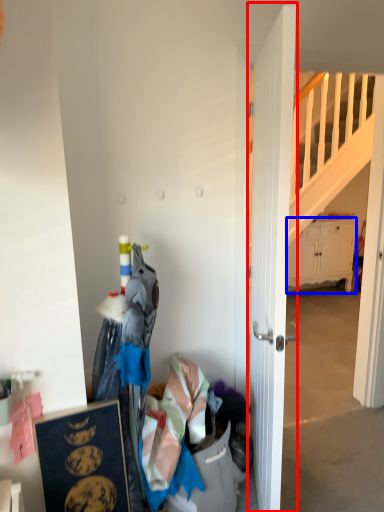
Question: Which object is further to the camera taking this photo, door (highlighted by a red box) or cabinetry (highlighted by a blue box)?

Choices:
 (A) door
 (B) cabinetry

Answer: (B)